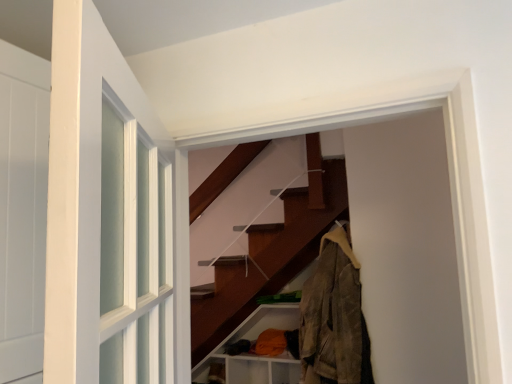
Question: Considering the positions of brown matte shelf at lower center and orange fabric at lower right in the image, is brown matte shelf at lower center taller or shorter than orange fabric at lower right?

Choices:
 (A) short
 (B) tall

Answer: (A)

Question: Considering the positions of point (204, 382) and point (294, 382), is point (204, 382) closer or farther from the camera than point (294, 382)?

Choices:
 (A) closer
 (B) farther

Answer: (A)

Question: Estimate the real-world distances between objects in this image. Which object is farther from the orange fabric at lower right?

Choices:
 (A) camouflage fabric jacket at right
 (B) brown matte shelf at lower center

Answer: (A)

Question: Based on their relative distances, which object is nearer to the camouflage fabric jacket at right?

Choices:
 (A) orange fabric at lower right
 (B) brown matte shelf at lower center

Answer: (A)